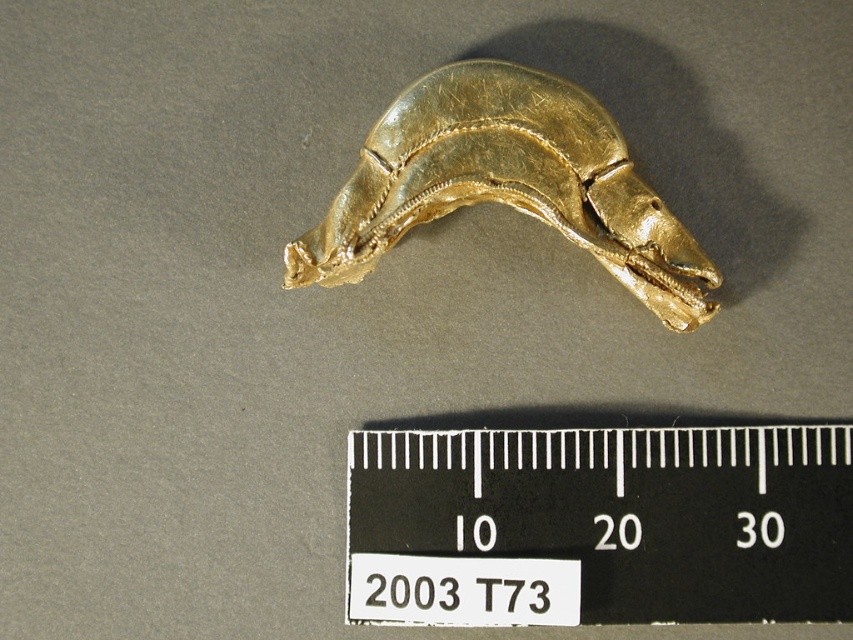
Question: Among these points, which one is nearest to the camera?

Choices:
 (A) (827, 483)
 (B) (390, 168)

Answer: (A)

Question: Does black plastic ruler at center appear on the right side of gold shiny horse at center?

Choices:
 (A) yes
 (B) no

Answer: (A)

Question: Does black plastic ruler at center appear on the left side of gold shiny horse at center?

Choices:
 (A) no
 (B) yes

Answer: (A)

Question: Is the position of black plastic ruler at center less distant than that of gold shiny horse at center?

Choices:
 (A) no
 (B) yes

Answer: (A)